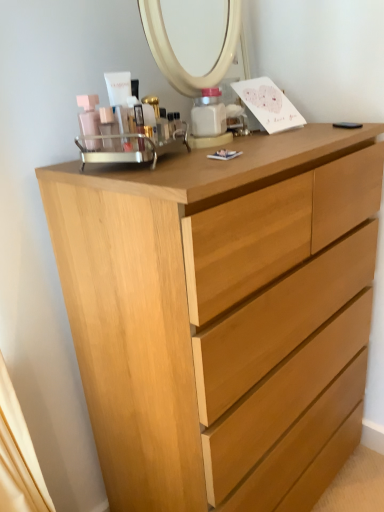
In order to face matte plastic container at center, should I rotate leftwards or rightwards?

A 11.157 degree turn to the left will do.

The width and height of the screenshot is (384, 512). What do you see at coordinates (106, 126) in the screenshot? I see `matte plastic container at center` at bounding box center [106, 126].

At what (x,y) coordinates should I click in order to perform the action: click on matte plastic container at center. Please return your answer as a coordinate pair (x, y). The width and height of the screenshot is (384, 512). Looking at the image, I should click on (106, 126).

This screenshot has width=384, height=512. I want to click on light wood chest of drawers at center, so pyautogui.click(x=215, y=307).

This screenshot has height=512, width=384. What do you see at coordinates (215, 307) in the screenshot?
I see `light wood chest of drawers at center` at bounding box center [215, 307].

This screenshot has height=512, width=384. Identify the location of matte plastic container at center. (106, 126).

Considering the positions of objects matte plastic container at center and light wood chest of drawers at center in the image provided, who is more to the left, matte plastic container at center or light wood chest of drawers at center?

matte plastic container at center.

Which object is further away from the camera, matte plastic container at center or light wood chest of drawers at center?

Positioned behind is matte plastic container at center.

Does point (99, 109) come farther from viewer compared to point (264, 390)?

No, (99, 109) is closer to viewer.

From the image's perspective, is matte plastic container at center above or below light wood chest of drawers at center?

From the image's perspective, matte plastic container at center appears above light wood chest of drawers at center.

From a real-world perspective, is matte plastic container at center physically below light wood chest of drawers at center?

No, from a real-world perspective, matte plastic container at center is not below light wood chest of drawers at center.

Between matte plastic container at center and light wood chest of drawers at center, which one has smaller width?

matte plastic container at center.

Is matte plastic container at center taller or shorter than light wood chest of drawers at center?

In the image, matte plastic container at center appears to be shorter than light wood chest of drawers at center.

Who is bigger, matte plastic container at center or light wood chest of drawers at center?

With larger size is light wood chest of drawers at center.

In the scene shown: Choose the correct answer: Is matte plastic container at center inside light wood chest of drawers at center or outside it?

matte plastic container at center is spatially situated outside light wood chest of drawers at center.

In the scene shown: Is matte plastic container at center not near light wood chest of drawers at center?

No, matte plastic container at center is not far from light wood chest of drawers at center.

Is matte plastic container at center aimed at light wood chest of drawers at center?

No.

How different are the orientations of matte plastic container at center and light wood chest of drawers at center in degrees?

There is a 15.6-degree angle between the facing directions of matte plastic container at center and light wood chest of drawers at center.

You are a GUI agent. You are given a task and a screenshot of the screen. Output one action in this format:
    pyautogui.click(x=<x>, y=<y>)
    Task: Click on the toiletry behind the light wood chest of drawers at center
    The height and width of the screenshot is (512, 384).
    Given the screenshot: What is the action you would take?
    pyautogui.click(x=106, y=126)

Would you say light wood chest of drawers at center is to the left or to the right of matte plastic container at center in the picture?

light wood chest of drawers at center is to the right of matte plastic container at center.

Which object is further away from the camera, light wood chest of drawers at center or matte plastic container at center?

Positioned behind is matte plastic container at center.

Which is closer, (280, 202) or (106, 148)?

Point (280, 202).

From the image's perspective, is light wood chest of drawers at center located above or below matte plastic container at center?

Based on their image positions, light wood chest of drawers at center is located beneath matte plastic container at center.

Looking at this image, from a real-world perspective, is light wood chest of drawers at center on top of matte plastic container at center?

Incorrect, from a real-world perspective, light wood chest of drawers at center is lower than matte plastic container at center.

Is light wood chest of drawers at center wider or thinner than matte plastic container at center?

Considering their sizes, light wood chest of drawers at center looks broader than matte plastic container at center.

Which of these two, light wood chest of drawers at center or matte plastic container at center, stands taller?

Standing taller between the two is light wood chest of drawers at center.

In the scene shown: Does light wood chest of drawers at center have a larger size compared to matte plastic container at center?

Yes.

Would you say matte plastic container at center is part of light wood chest of drawers at center's contents?

No.

Is light wood chest of drawers at center beside matte plastic container at center?

No, light wood chest of drawers at center is not making contact with matte plastic container at center.

Is matte plastic container at center at the back of light wood chest of drawers at center?

No, matte plastic container at center is not at the back of light wood chest of drawers at center.

Can you tell me how much light wood chest of drawers at center and matte plastic container at center differ in facing direction?

There is a 15.6-degree angle between the facing directions of light wood chest of drawers at center and matte plastic container at center.

You are a GUI agent. You are given a task and a screenshot of the screen. Output one action in this format:
    pyautogui.click(x=<x>, y=<y>)
    Task: Click on the toiletry lying behind the light wood chest of drawers at center
    Image resolution: width=384 pixels, height=512 pixels.
    Given the screenshot: What is the action you would take?
    pyautogui.click(x=106, y=126)

The width and height of the screenshot is (384, 512). I want to click on toiletry lying on the left of light wood chest of drawers at center, so click(106, 126).

You are a GUI agent. You are given a task and a screenshot of the screen. Output one action in this format:
    pyautogui.click(x=<x>, y=<y>)
    Task: Click on the chest of drawers on the right of the matte plastic container at center
    This screenshot has height=512, width=384.
    Given the screenshot: What is the action you would take?
    click(x=215, y=307)